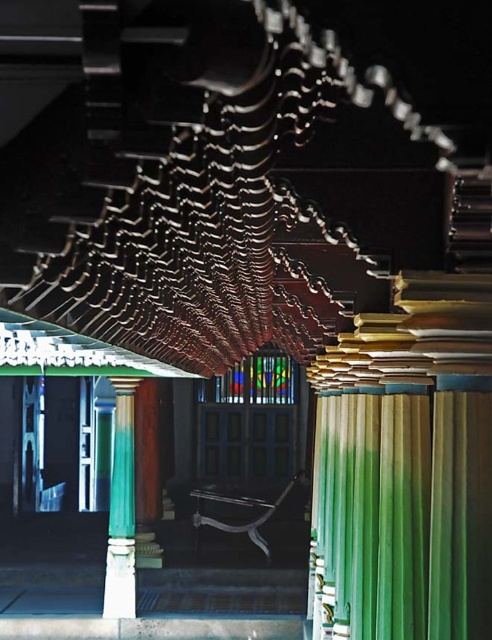
You are an interior designer assessing the space under the ornate roofline. You need to determine if the green fabric curtain at center can be hung from the green polished column at center. Based on their widths, will the curtain fit without overlapping the column?

The green fabric curtain at center has a width less than the green polished column at center, so it can be hung without overlapping the column.

You are standing in front of the traditional architectural structure and notice the green fabric curtain at center. Can you determine its exact position relative to the ornate roofline?

The green fabric curtain at center is located at point [412,502], which places it below the ornate roofline since its y coordinate is higher than the curtain.

You are an architect examining the structure. You notice the green fabric curtain at center and the green polished column at center. Which object is positioned higher in the scene?

The green fabric curtain at center is above the green polished column at center, so it is positioned higher in the scene.